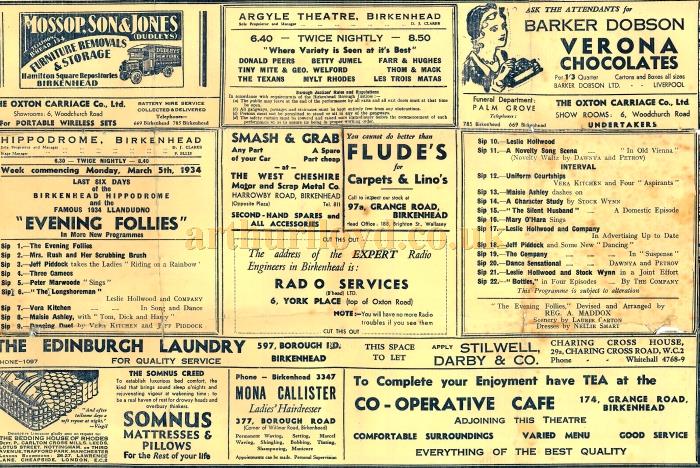
The height and width of the screenshot is (468, 700). In order to click on picture of mattress coils in this screenshot , I will do `click(32, 390)`, `click(74, 387)`, `click(42, 410)`.